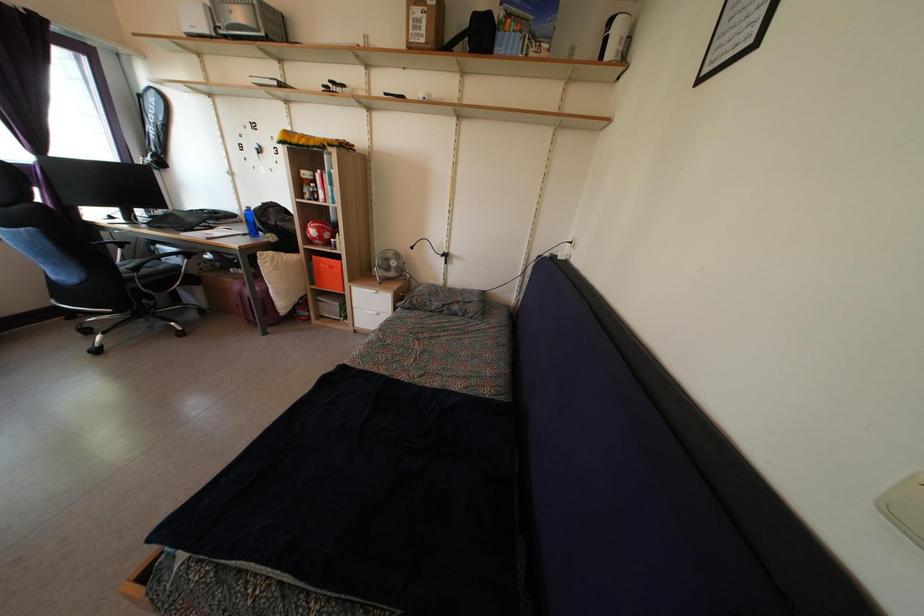
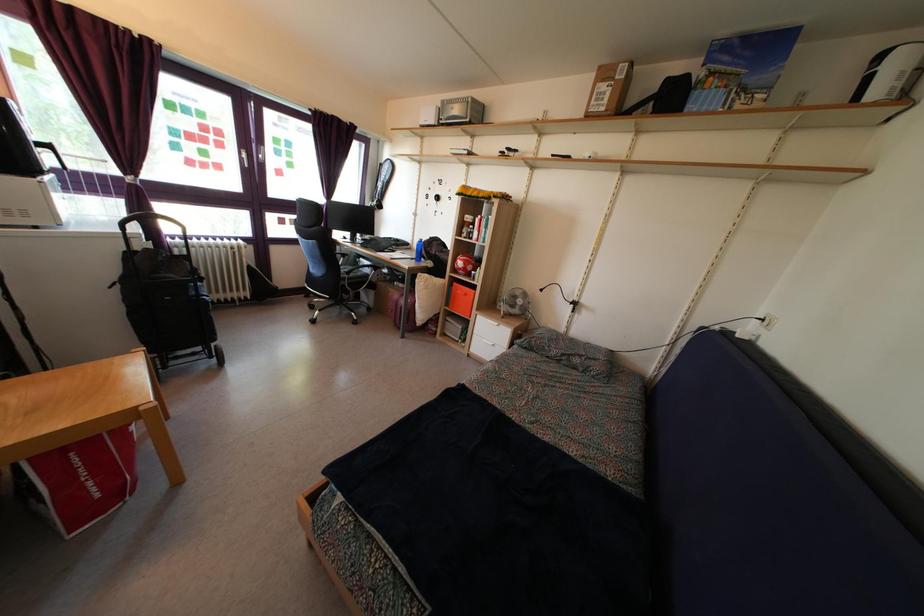
Where in the second image is the point corresponding to pixel 124 253 from the first image?

(346, 264)